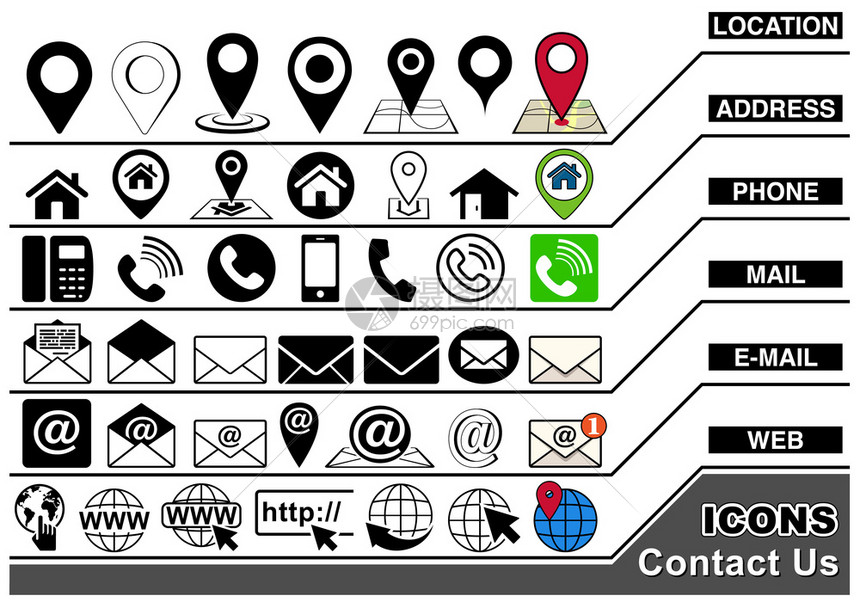
The width and height of the screenshot is (860, 608). I want to click on globes, so click(x=41, y=494), click(x=125, y=544), click(x=206, y=536), click(x=396, y=508), click(x=465, y=516), click(x=573, y=520).